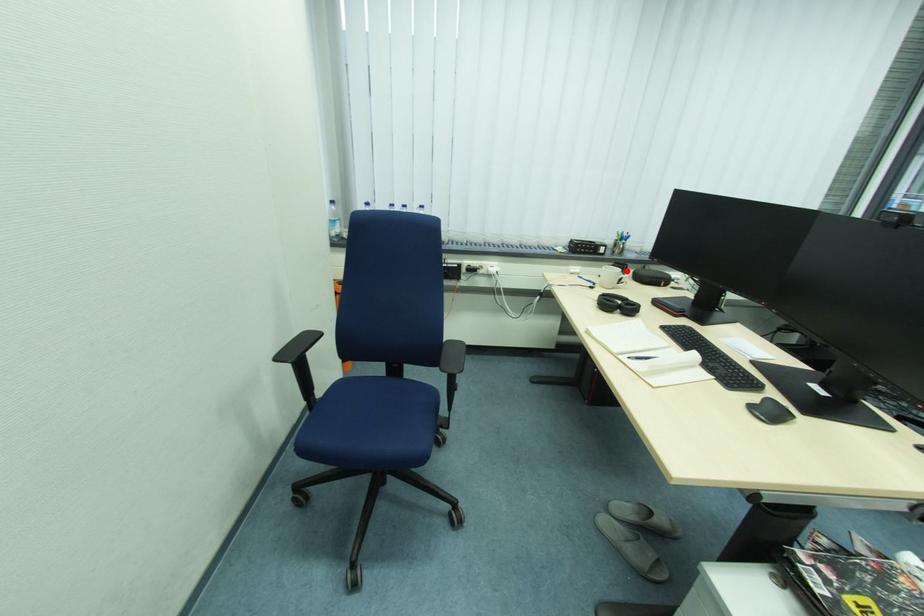
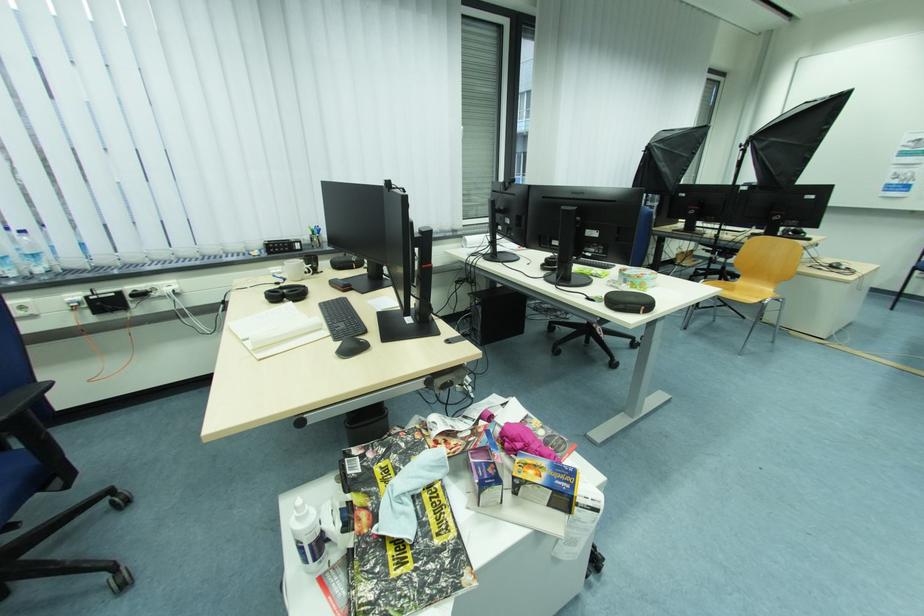
The point at the highlighted location is marked in the first image. Where is the corresponding point in the second image?

(309, 262)